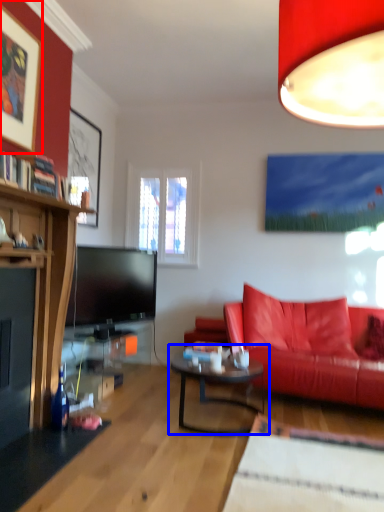
Question: Which object is further to the camera taking this photo, picture frame (highlighted by a red box) or coffee table (highlighted by a blue box)?

Choices:
 (A) picture frame
 (B) coffee table

Answer: (B)